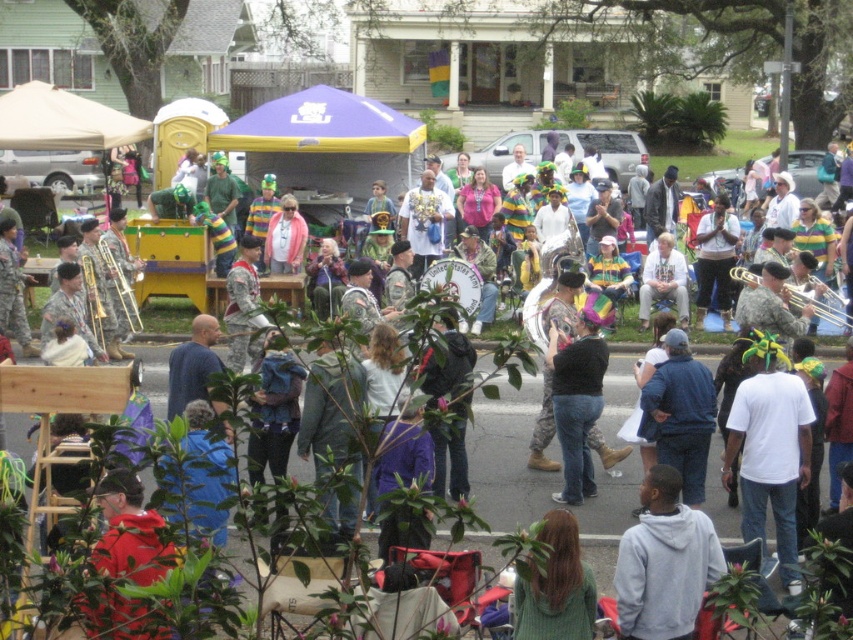
Who is more forward, (784, 442) or (630, 545)?

Point (630, 545) is more forward.

Measure the distance between white cotton shirt at center and camera.

white cotton shirt at center and camera are 11.59 meters apart from each other.

The height and width of the screenshot is (640, 853). Describe the element at coordinates (770, 449) in the screenshot. I see `white cotton shirt at center` at that location.

Where is `white cotton shirt at center`? white cotton shirt at center is located at coordinates (770, 449).

Can you confirm if gray hoodie at lower center is shorter than black matte shirt at center?

Correct, gray hoodie at lower center is not as tall as black matte shirt at center.

Who is taller, gray hoodie at lower center or black matte shirt at center?

black matte shirt at center

You are a GUI agent. You are given a task and a screenshot of the screen. Output one action in this format:
    pyautogui.click(x=<x>, y=<y>)
    Task: Click on the gray hoodie at lower center
    
    Given the screenshot: What is the action you would take?
    pyautogui.click(x=664, y=563)

Does white cotton shirt at center appear under black matte shirt at center?

Yes.

Measure the distance between white cotton shirt at center and camera.

white cotton shirt at center and camera are 38.01 feet apart from each other.

The width and height of the screenshot is (853, 640). Describe the element at coordinates (770, 449) in the screenshot. I see `white cotton shirt at center` at that location.

The width and height of the screenshot is (853, 640). I want to click on white cotton shirt at center, so click(770, 449).